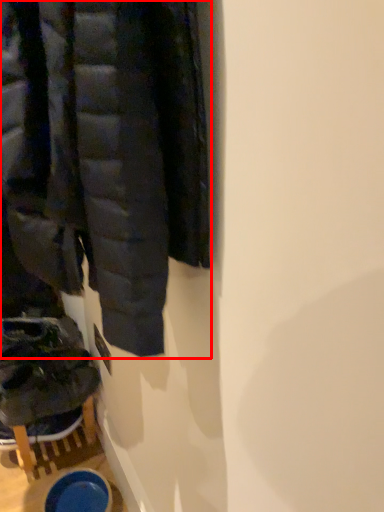
Question: Observing the image, what is the correct spatial positioning of jacket (annotated by the red box) in reference to footwear?

Choices:
 (A) right
 (B) left

Answer: (A)